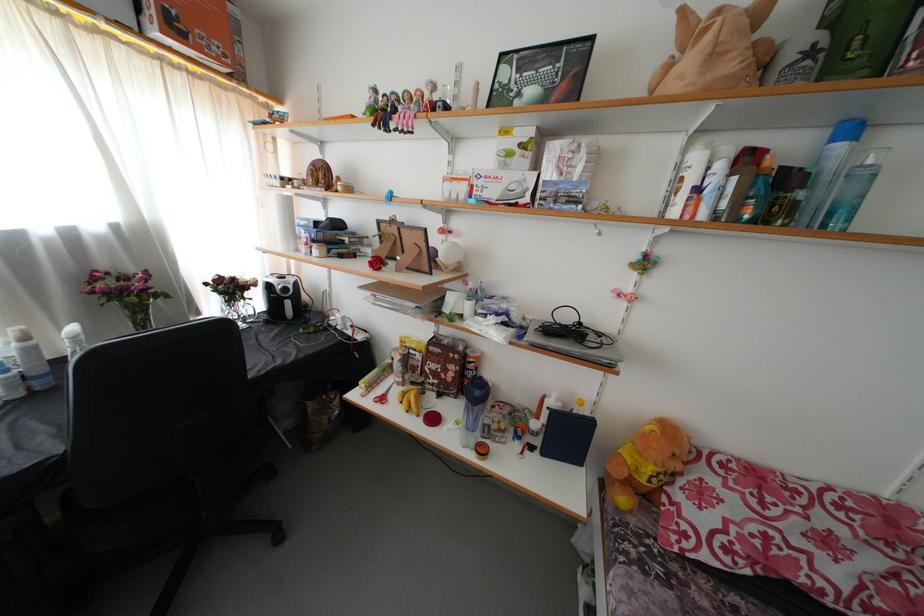
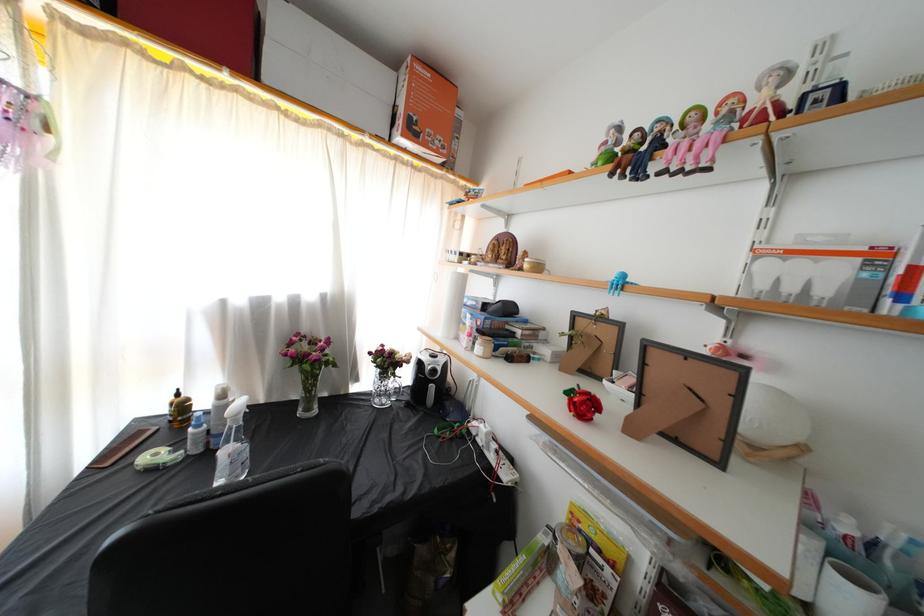
Find the pixel in the second image that matches (388,121) in the first image.

(638, 161)